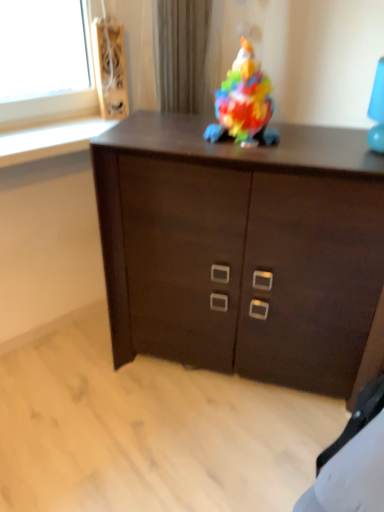
Question: Is point (145, 150) positioned closer to the camera than point (241, 51)?

Choices:
 (A) farther
 (B) closer

Answer: (B)

Question: Relative to multicolored plastic toy at center, is dark wood cabinet at center in front or behind?

Choices:
 (A) behind
 (B) front

Answer: (B)

Question: Based on their relative distances, which object is farther from the dark wood cabinet at center?

Choices:
 (A) multicolored plastic toy at center
 (B) wooden speaker at upper left

Answer: (B)

Question: Estimate the real-world distances between objects in this image. Which object is farther from the wooden speaker at upper left?

Choices:
 (A) multicolored plastic toy at center
 (B) dark wood cabinet at center

Answer: (B)